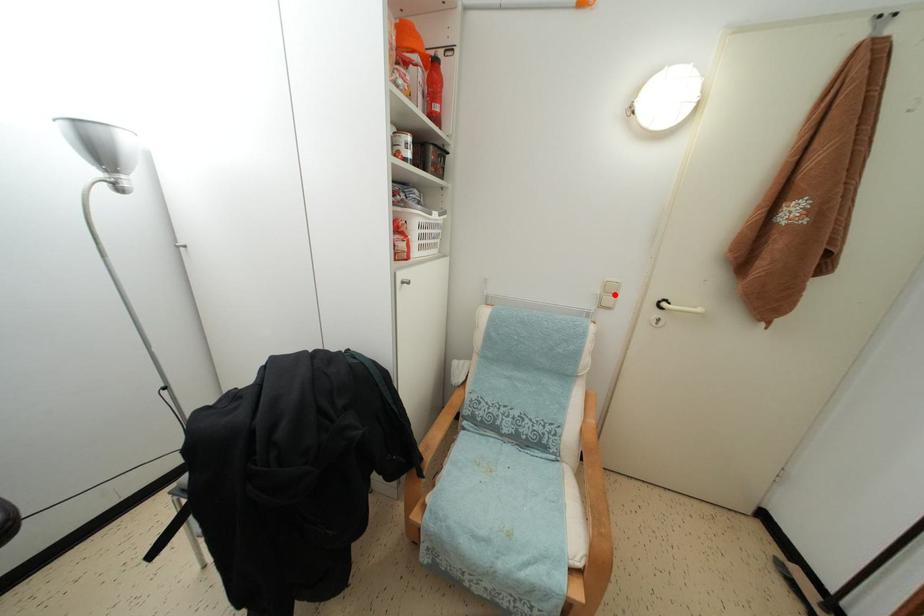
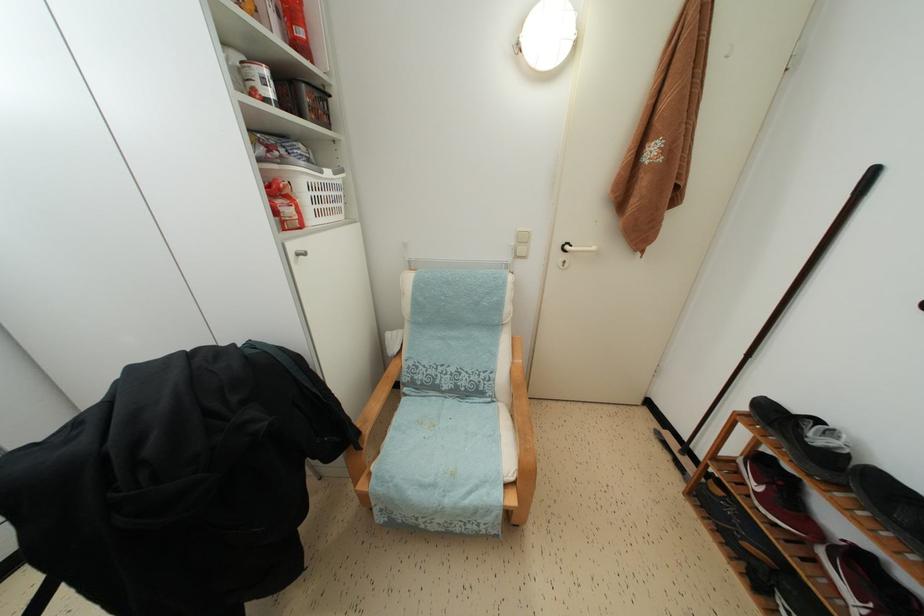
Find the pixel in the second image that matches the highlighted location in the first image.

(527, 245)